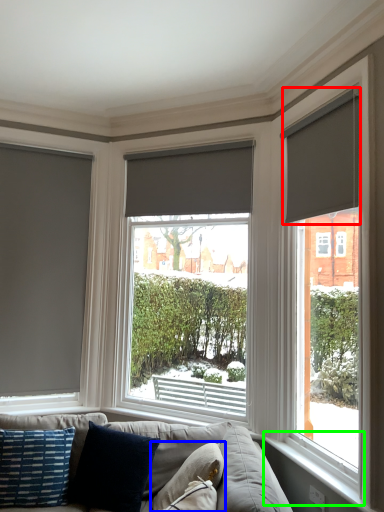
Question: Considering the real-world distances, which object is farthest from window blind (highlighted by a red box)? pillow (highlighted by a blue box) or window sill (highlighted by a green box)?

Choices:
 (A) pillow
 (B) window sill

Answer: (A)